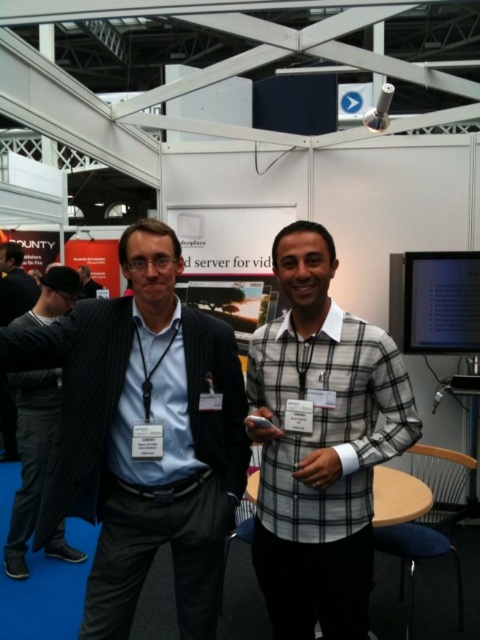
You are at a trade show and need to hand out brochures to both the dark gray suit at center and the matte black suit at center. If you can only carry 3 brochures at a time, how many trips will you need to make to ensure both receive one?

Both the dark gray suit at center and the matte black suit at center need to receive a brochure. Since you can carry 3 brochures per trip, you can give one brochure to each and still have one left over. Therefore, you only need to make one trip.

You are at the trade show booth and need to place two markers on the floor at the coordinates provided. The first marker is at point (179, 397) and the second at point (351, 332). Which marker is closer to the back wall of the booth?

Point (179, 397) is behind point (351, 332), so the first marker at point (179, 397) is closer to the back wall of the booth.